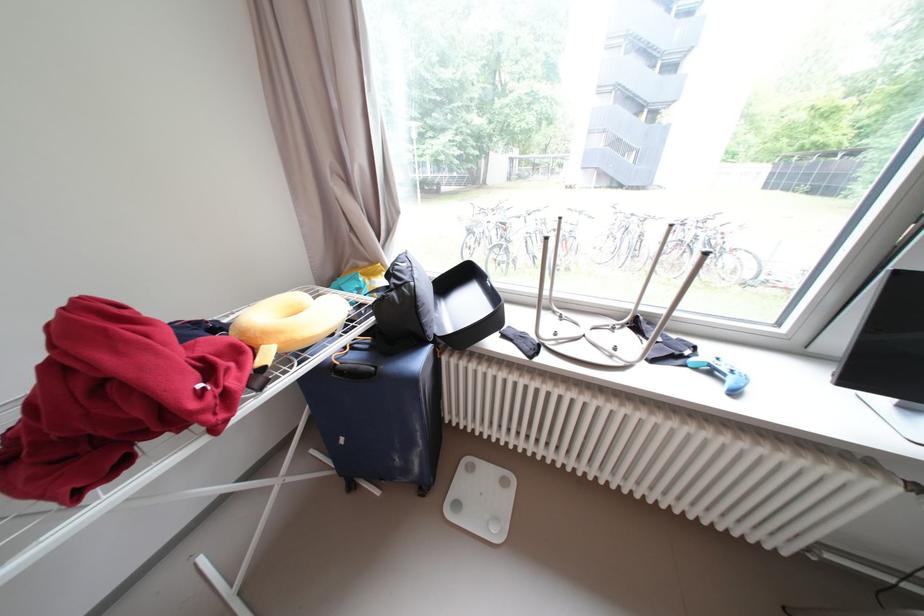
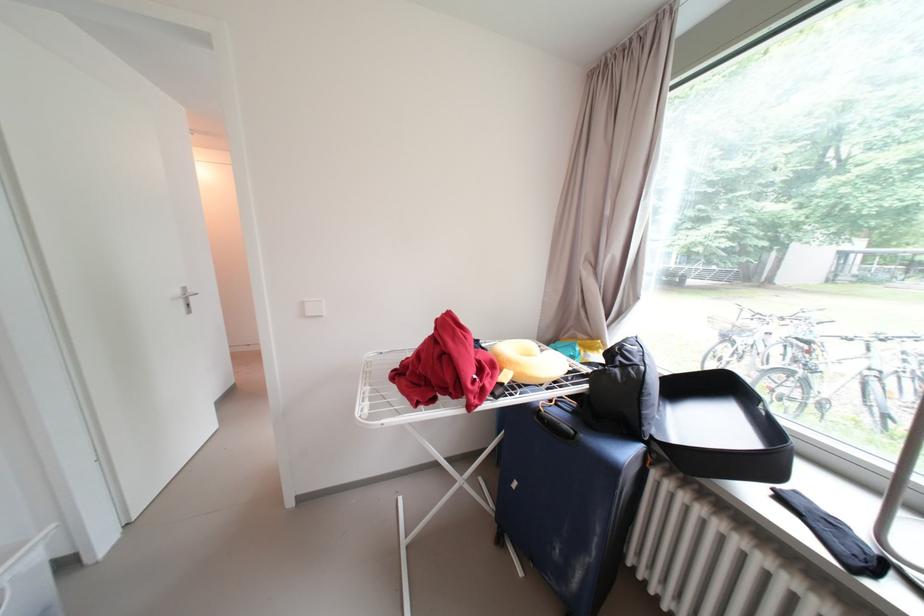
Where in the second image is the point corresponding to pixel 439 328 from the first image?

(658, 424)